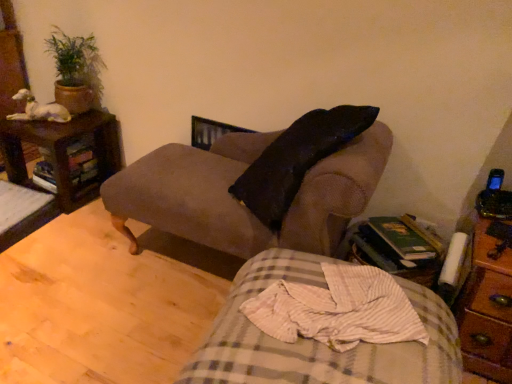
In order to click on free space in front of brown wooden nightstand at left, arranged as the second nightstand when ordered from the bottom in this screenshot , I will do `click(73, 231)`.